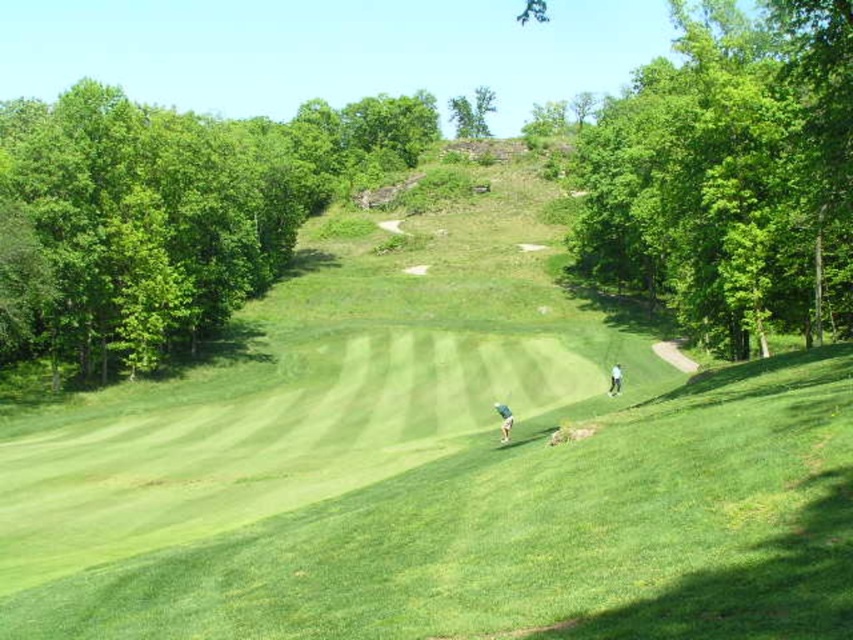
Question: Is green leafy trees at left thinner than white fabric person at lower right?

Choices:
 (A) no
 (B) yes

Answer: (A)

Question: Which point is closer to the camera?

Choices:
 (A) (51, 275)
 (B) (496, 401)
 (C) (457, 128)
 (D) (740, 326)

Answer: (D)

Question: Does green leafy tree at upper right have a smaller size compared to green leafy tree at upper center?

Choices:
 (A) no
 (B) yes

Answer: (B)

Question: Which of the following is the closest to the observer?

Choices:
 (A) (486, 104)
 (B) (675, 285)

Answer: (B)

Question: Is green leafy tree at upper right below light brown leather golf club at center?

Choices:
 (A) no
 (B) yes

Answer: (A)

Question: Among these points, which one is nearest to the camera?

Choices:
 (A) (207, 282)
 (B) (483, 134)
 (C) (734, 196)
 (D) (621, 374)

Answer: (C)